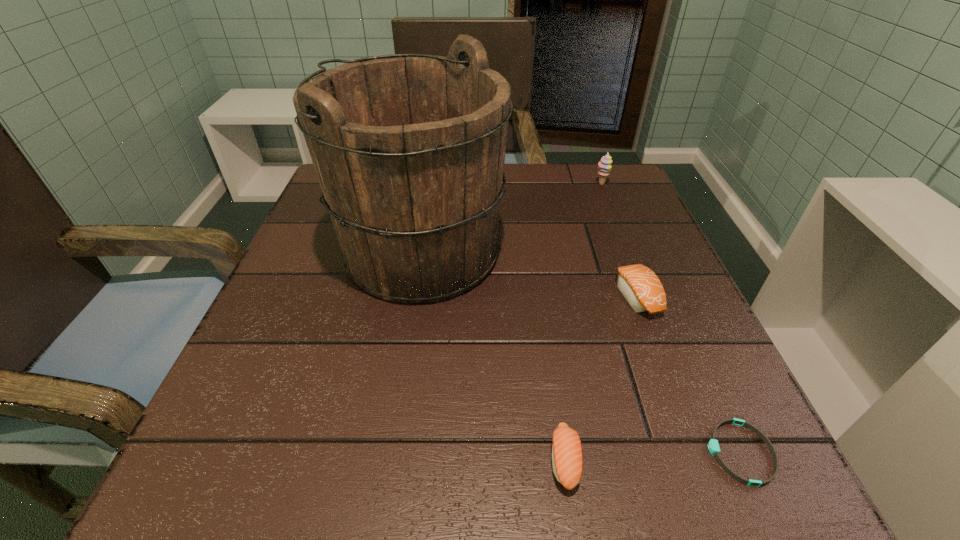
Where is `free space located on the left of the farther sushi`? The image size is (960, 540). free space located on the left of the farther sushi is located at coordinates (508, 296).

Where is `vacant space located 0.220m on the right of the nearer sushi`? This screenshot has width=960, height=540. vacant space located 0.220m on the right of the nearer sushi is located at coordinates (749, 460).

At what (x,y) coordinates should I click in order to perform the action: click on vacant position located on the buckle of the shortest object. Please return your answer as a coordinate pair (x, y). This screenshot has height=540, width=960. Looking at the image, I should click on (451, 453).

At what (x,y) coordinates should I click in order to perform the action: click on vacant area situated on the buckle of the shortest object. Please return your answer as a coordinate pair (x, y). Looking at the image, I should click on (549, 453).

Locate an element on the screen. vacant space located on the buckle of the shortest object is located at coordinates (451, 453).

You are a GUI agent. You are given a task and a screenshot of the screen. Output one action in this format:
    pyautogui.click(x=<x>, y=<y>)
    Task: Click on the bucket located in the far edge section of the desktop
    
    Given the screenshot: What is the action you would take?
    pyautogui.click(x=409, y=149)

The width and height of the screenshot is (960, 540). I want to click on sherbert at the far edge, so click(x=604, y=165).

In order to click on sushi that is at the near edge in this screenshot , I will do `click(567, 457)`.

The height and width of the screenshot is (540, 960). I want to click on wristband that is at the near edge, so click(713, 445).

Locate an element on the screen. object that is at the left edge is located at coordinates tap(409, 149).